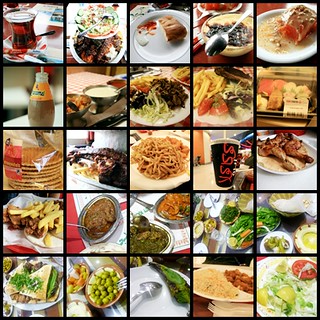
Image resolution: width=320 pixels, height=320 pixels. In order to click on utensils in this screenshot , I will do `click(223, 46)`, `click(90, 28)`, `click(50, 31)`, `click(78, 225)`, `click(152, 288)`, `click(122, 286)`.